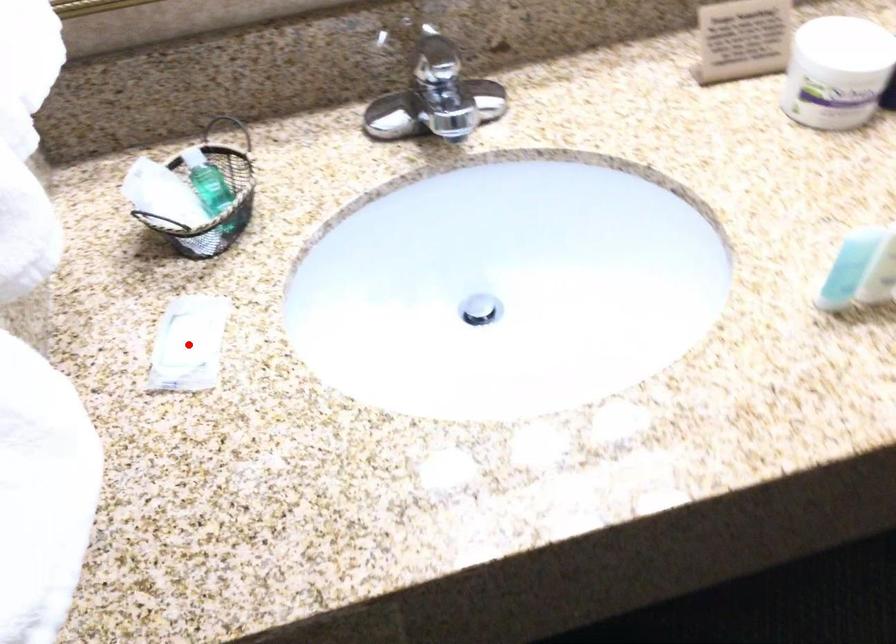
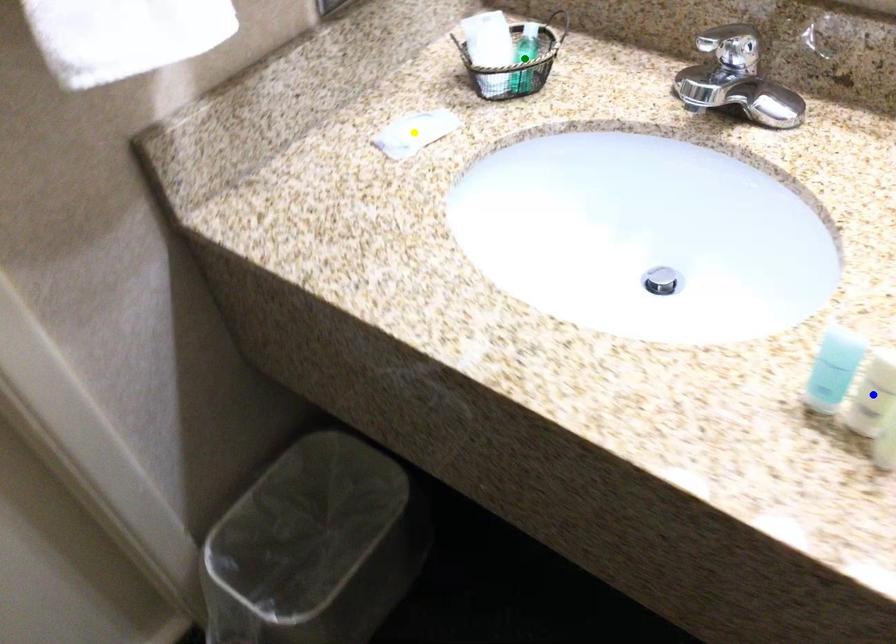
Question: I am providing you with two images of the same scene from different viewpoints. A red point is marked on the first image. You are given multiple points on the second image. Which spot in image 2 lines up with the point in image 1?

Choices:
 (A) yellow point
 (B) green point
 (C) blue point

Answer: (A)